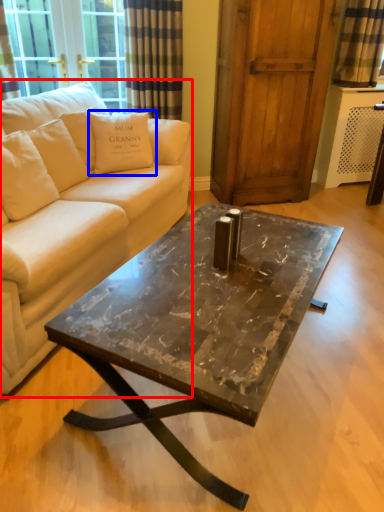
Question: Which of the following is the farthest to the observer, studio couch (highlighted by a red box) or pillow (highlighted by a blue box)?

Choices:
 (A) studio couch
 (B) pillow

Answer: (B)